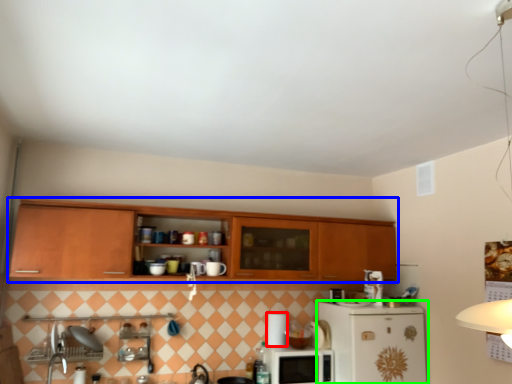
Question: Which object is positioned closest to appliance (highlighted by a red box)? Select from cabinetry (highlighted by a blue box) and refrigerator (highlighted by a green box).

Choices:
 (A) cabinetry
 (B) refrigerator

Answer: (B)